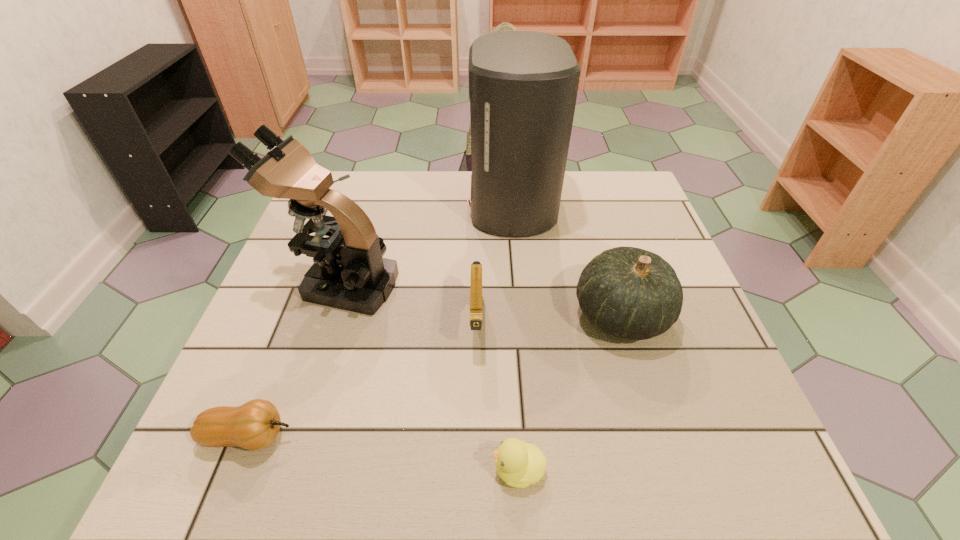
Identify the location of the farthest object. (523, 85).

In order to click on the fifth shortest object in this screenshot , I will do `click(349, 273)`.

The width and height of the screenshot is (960, 540). Find the location of `the taller gourd`. the taller gourd is located at coordinates (627, 292).

At what (x,y) coordinates should I click in order to perform the action: click on the right gourd. Please return your answer as a coordinate pair (x, y). This screenshot has height=540, width=960. Looking at the image, I should click on (627, 292).

At what (x,y) coordinates should I click in order to perform the action: click on pistol. Please return your answer as a coordinate pair (x, y). Looking at the image, I should click on (476, 267).

I want to click on the nearer gourd, so click(x=254, y=425).

You are a GUI agent. You are given a task and a screenshot of the screen. Output one action in this format:
    pyautogui.click(x=<x>, y=<y>)
    Task: Click on the shorter gourd
    This screenshot has width=960, height=540.
    Given the screenshot: What is the action you would take?
    pyautogui.click(x=254, y=425)

This screenshot has height=540, width=960. What are the coordinates of `duckling` in the screenshot? It's located at (519, 464).

You are a GUI agent. You are given a task and a screenshot of the screen. Output one action in this format:
    pyautogui.click(x=<x>, y=<y>)
    Task: Click on the free location located 0.370m on the button side of the coffee maker
    
    Given the screenshot: What is the action you would take?
    [338, 205]

At what (x,y) coordinates should I click in order to perform the action: click on vacant space located 0.360m on the button side of the coffee maker. Please return your answer as a coordinate pair (x, y). The width and height of the screenshot is (960, 540). Looking at the image, I should click on (342, 205).